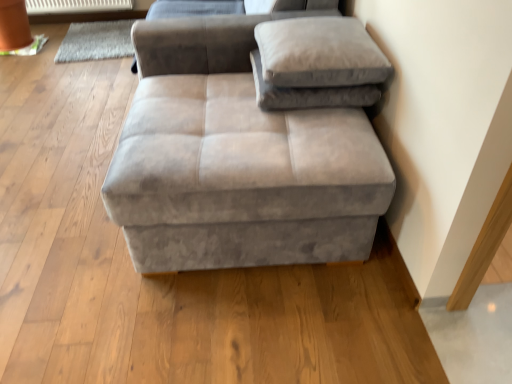
Question: Is suede gray ottoman at center closer to camera compared to suede gray pillow at upper right, placed as the first pillow when sorted from bottom to top?

Choices:
 (A) yes
 (B) no

Answer: (A)

Question: Does suede gray ottoman at center have a smaller size compared to suede gray pillow at upper right, placed as the first pillow when sorted from bottom to top?

Choices:
 (A) no
 (B) yes

Answer: (A)

Question: From a real-world perspective, is suede gray ottoman at center physically above suede gray pillow at upper right, placed as the first pillow when sorted from bottom to top?

Choices:
 (A) yes
 (B) no

Answer: (B)

Question: Can we say suede gray ottoman at center lies outside suede gray pillow at upper right, which is the 2th pillow in top-to-bottom order?

Choices:
 (A) no
 (B) yes

Answer: (B)

Question: Is suede gray ottoman at center shorter than suede gray pillow at upper right, which is the 2th pillow in top-to-bottom order?

Choices:
 (A) yes
 (B) no

Answer: (B)

Question: Is suede gray pillow at upper right, placed as the first pillow when sorted from bottom to top, bigger or smaller than suede-like beige pillow at upper right, which appears as the 2th pillow when ordered from the bottom?

Choices:
 (A) small
 (B) big

Answer: (A)

Question: Considering their positions, is suede gray pillow at upper right, which is the 2th pillow in top-to-bottom order, located in front of or behind suede-like beige pillow at upper right, which appears as the 2th pillow when ordered from the bottom?

Choices:
 (A) behind
 (B) front

Answer: (A)

Question: Does point (346, 92) appear closer or farther from the camera than point (365, 74)?

Choices:
 (A) farther
 (B) closer

Answer: (A)

Question: From the image's perspective, is suede gray pillow at upper right, which is the 2th pillow in top-to-bottom order, above or below suede-like beige pillow at upper right, which appears as the 2th pillow when ordered from the bottom?

Choices:
 (A) above
 (B) below

Answer: (B)

Question: Do you think white plastic radiator at upper left is within suede gray ottoman at center, or outside of it?

Choices:
 (A) inside
 (B) outside

Answer: (B)

Question: Does point (125, 0) appear closer or farther from the camera than point (189, 86)?

Choices:
 (A) farther
 (B) closer

Answer: (A)

Question: Is white plastic radiator at upper left to the left or to the right of suede gray ottoman at center in the image?

Choices:
 (A) left
 (B) right

Answer: (A)

Question: Looking at their shapes, would you say white plastic radiator at upper left is wider or thinner than suede gray ottoman at center?

Choices:
 (A) wide
 (B) thin

Answer: (B)

Question: Considering their positions, is white plastic radiator at upper left located in front of or behind gray woolen mat at upper left?

Choices:
 (A) front
 (B) behind

Answer: (B)

Question: From a real-world perspective, is white plastic radiator at upper left physically located above or below gray woolen mat at upper left?

Choices:
 (A) below
 (B) above

Answer: (B)